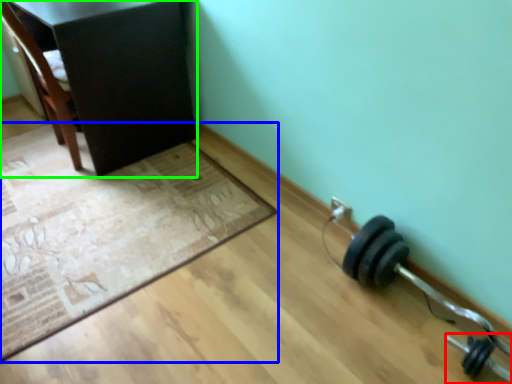
Question: Which object is the closest to the dumbbell (highlighted by a red box)? Choose among these: mat (highlighted by a blue box) or furniture (highlighted by a green box).

Choices:
 (A) mat
 (B) furniture

Answer: (A)